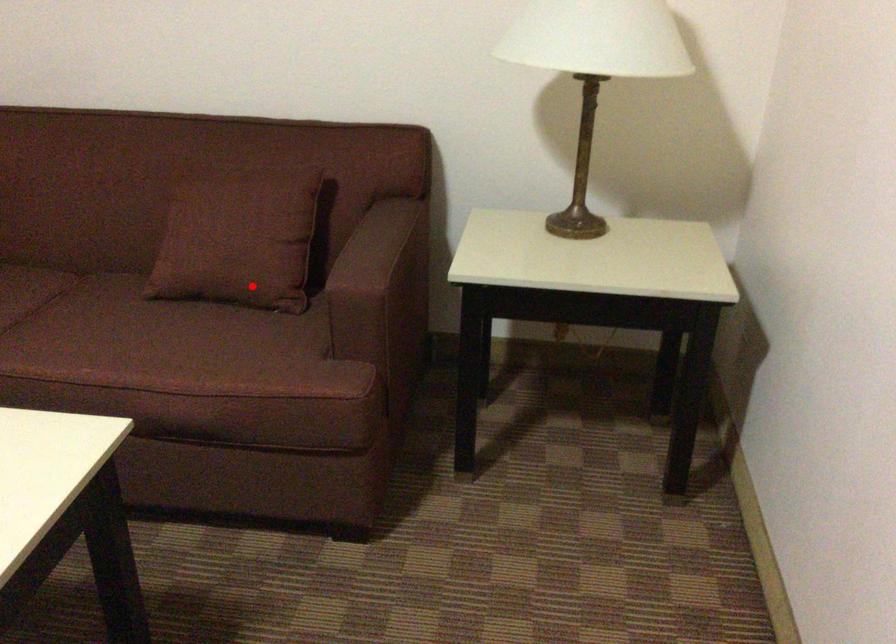
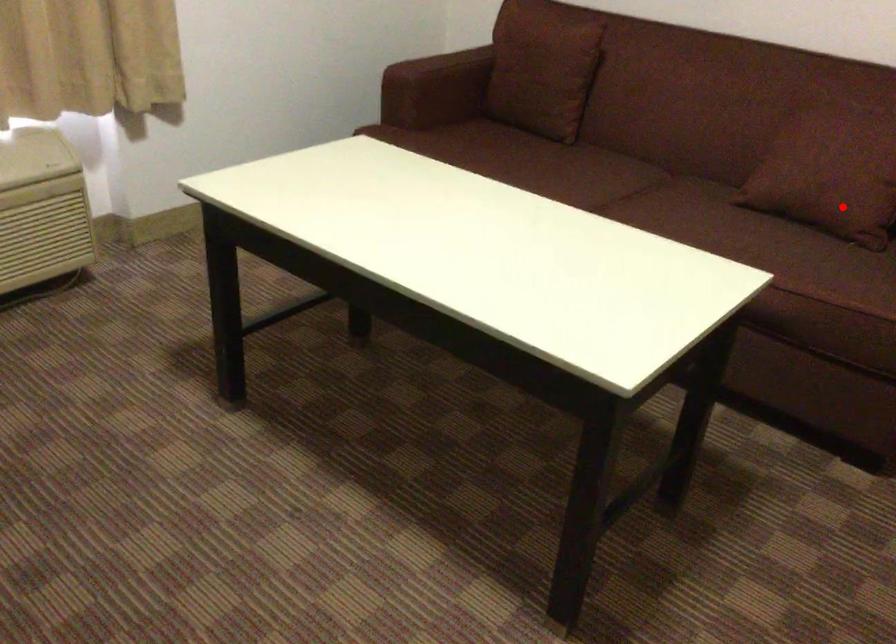
I am providing you with two images of the same scene from different viewpoints. A red point is marked on the first image and another point is marked on the second image. Are the points marked in image1 and image2 representing the same 3D position?

Yes